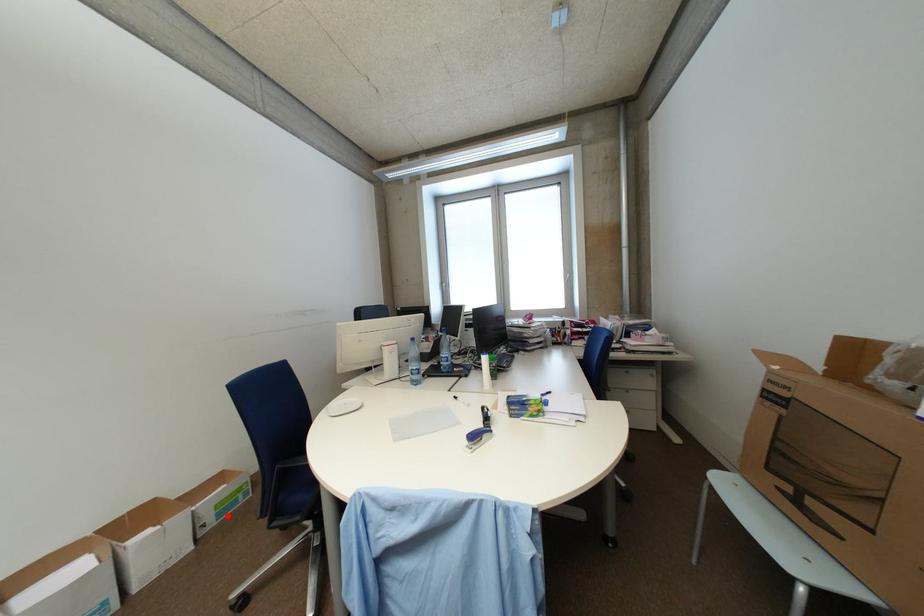
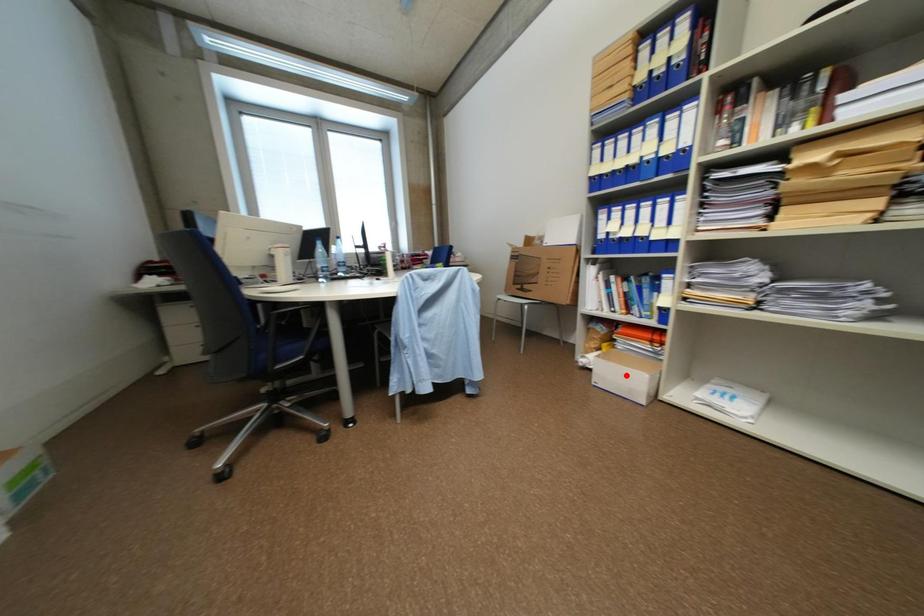
I am providing you with two images of the same scene from different viewpoints. A red point is marked on the first image and another point is marked on the second image. Do the highlighted points in image1 and image2 indicate the same real-world spot?

No